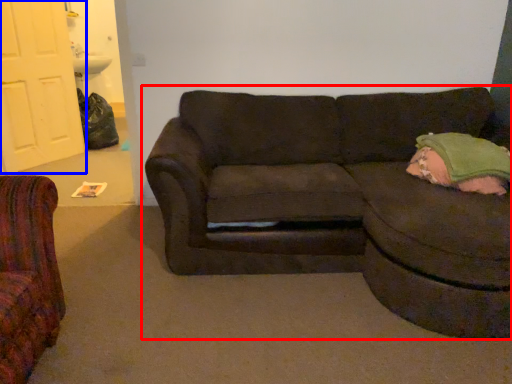
Question: Which object is closer to the camera taking this photo, studio couch (highlighted by a red box) or door (highlighted by a blue box)?

Choices:
 (A) studio couch
 (B) door

Answer: (A)